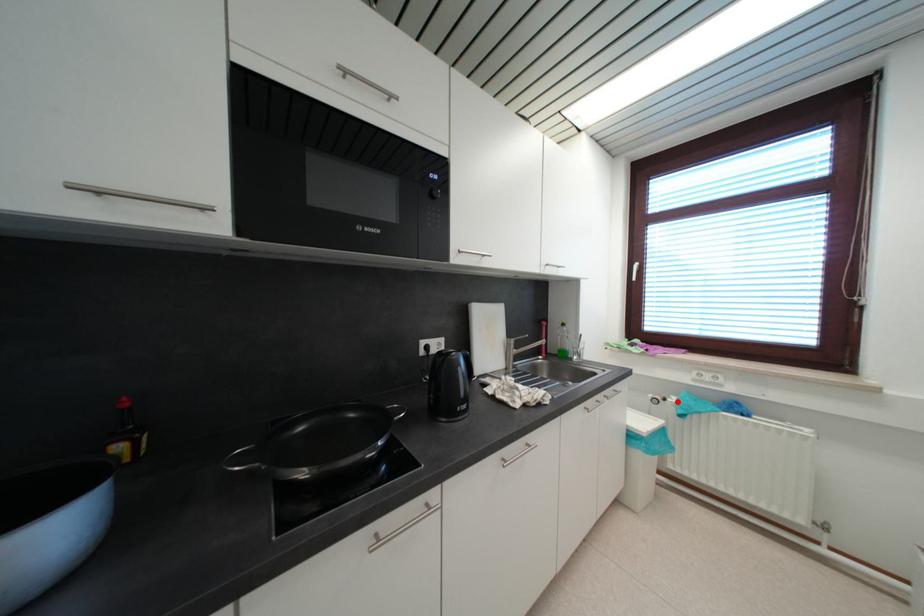
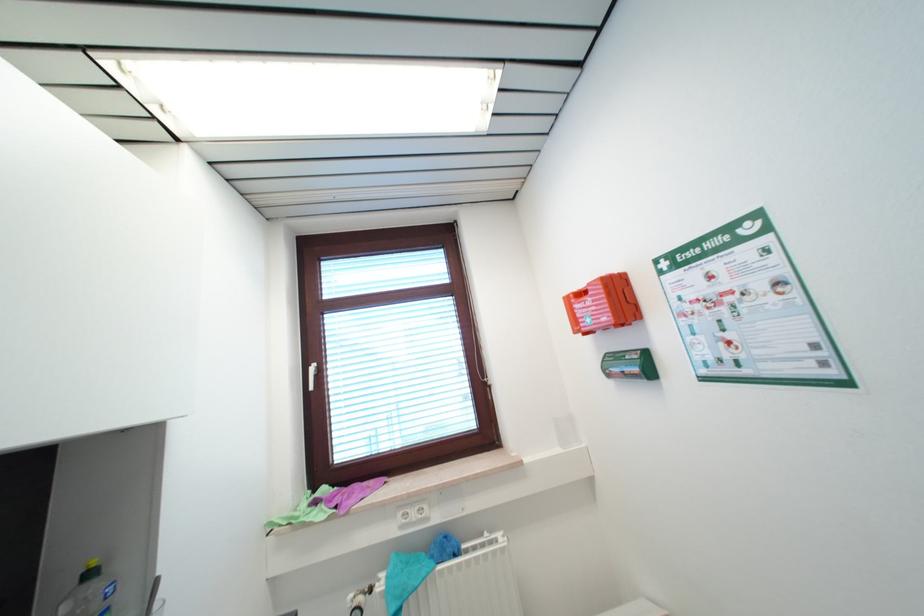
Locate, in the second image, the point that corresponds to the highlighted location in the first image.

(385, 589)